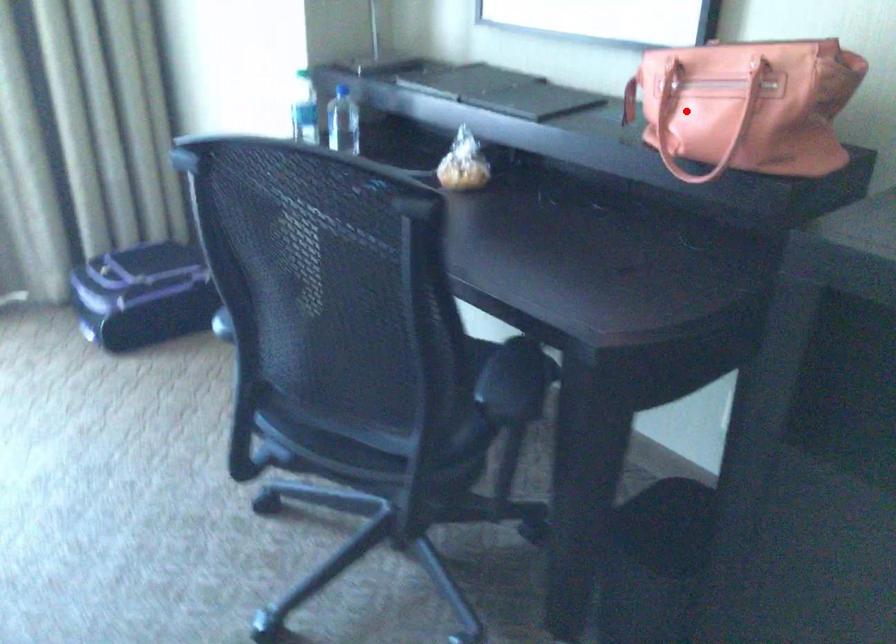
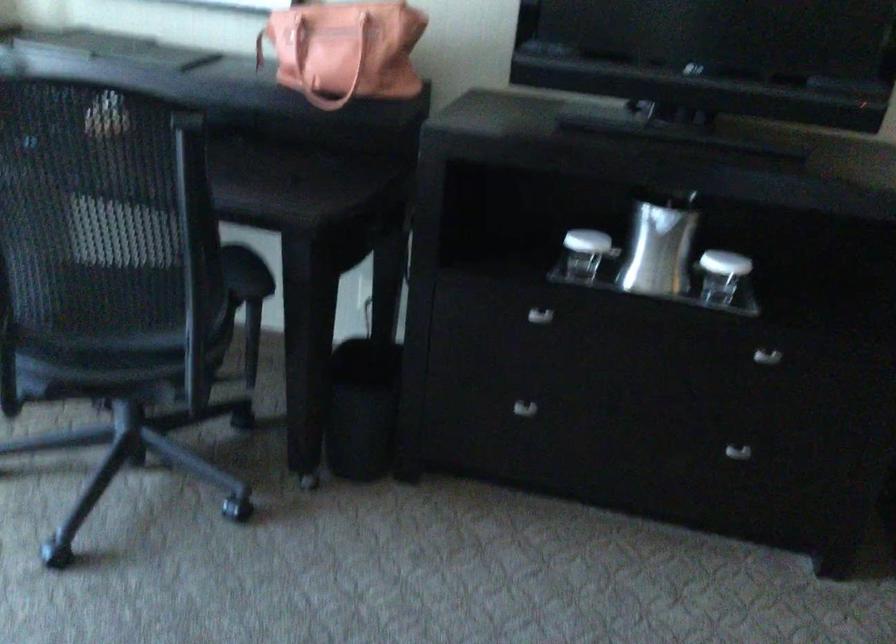
Question: I am providing you with two images of the same scene from different viewpoints. In image1, a red point is highlighted. Considering the same 3D point in image2, which of the following is correct?

Choices:
 (A) It is closer
 (B) It is farther

Answer: (B)